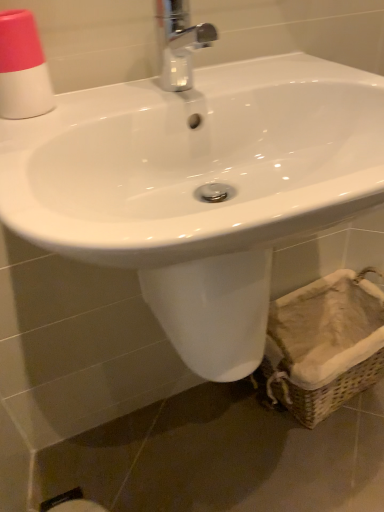
Question: Should I look upward or downward to see chrome metallic faucet at upper center?

Choices:
 (A) down
 (B) up

Answer: (B)

Question: From a real-world perspective, is woven beige basket at lower right under white glossy sink at center?

Choices:
 (A) yes
 (B) no

Answer: (A)

Question: Is woven beige basket at lower right aimed at white glossy sink at center?

Choices:
 (A) yes
 (B) no

Answer: (B)

Question: Is woven beige basket at lower right located outside white glossy sink at center?

Choices:
 (A) yes
 (B) no

Answer: (A)

Question: Considering the relative sizes of woven beige basket at lower right and white glossy sink at center in the image provided, is woven beige basket at lower right thinner than white glossy sink at center?

Choices:
 (A) no
 (B) yes

Answer: (B)

Question: Is woven beige basket at lower right positioned before white glossy sink at center?

Choices:
 (A) no
 (B) yes

Answer: (A)

Question: Can you confirm if woven beige basket at lower right is wider than white glossy sink at center?

Choices:
 (A) no
 (B) yes

Answer: (A)

Question: Can you confirm if woven beige basket at lower right is thinner than pink matte cup at upper left?

Choices:
 (A) no
 (B) yes

Answer: (A)

Question: From a real-world perspective, is woven beige basket at lower right physically below pink matte cup at upper left?

Choices:
 (A) yes
 (B) no

Answer: (A)

Question: Considering the relative sizes of woven beige basket at lower right and pink matte cup at upper left in the image provided, is woven beige basket at lower right taller than pink matte cup at upper left?

Choices:
 (A) yes
 (B) no

Answer: (A)

Question: Is woven beige basket at lower right smaller than pink matte cup at upper left?

Choices:
 (A) yes
 (B) no

Answer: (B)

Question: Considering the relative positions of woven beige basket at lower right and pink matte cup at upper left in the image provided, is woven beige basket at lower right in front of pink matte cup at upper left?

Choices:
 (A) no
 (B) yes

Answer: (A)

Question: Does woven beige basket at lower right turn towards pink matte cup at upper left?

Choices:
 (A) no
 (B) yes

Answer: (A)

Question: Is chrome metallic faucet at upper center facing towards white glossy sink at center?

Choices:
 (A) yes
 (B) no

Answer: (B)